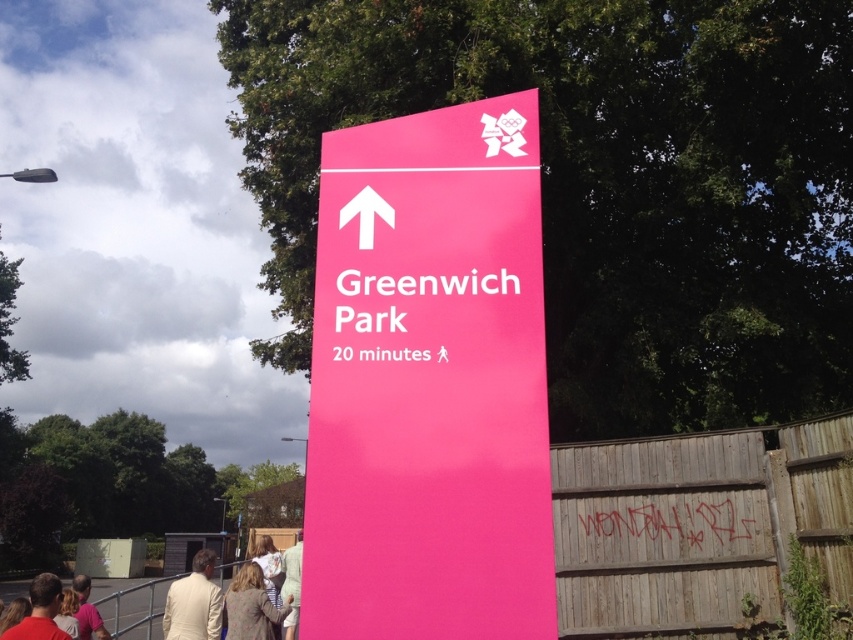
Question: Can you confirm if matte pink sign at center is wider than blonde hair at lower left?

Choices:
 (A) no
 (B) yes

Answer: (A)

Question: Which point appears farthest from the camera in this image?

Choices:
 (A) (38, 604)
 (B) (80, 573)
 (C) (170, 595)

Answer: (B)

Question: Observing the image, what is the correct spatial positioning of light brown fabric shirt at lower center in reference to light brown hair at lower left?

Choices:
 (A) left
 (B) right

Answer: (B)

Question: Which is nearer to the light brown textured coat at lower center?

Choices:
 (A) blonde hair at lower left
 (B) light brown hair at lower left
 (C) light beige suit at lower left

Answer: (C)

Question: Is matte pink sign at center positioned in front of light brown fabric shirt at lower center?

Choices:
 (A) yes
 (B) no

Answer: (A)

Question: Among these objects, which one is nearest to the camera?

Choices:
 (A) light beige cotton shirt at lower center
 (B) light brown fabric shirt at lower center
 (C) light beige suit at lower left
 (D) light brown textured coat at lower center

Answer: (A)